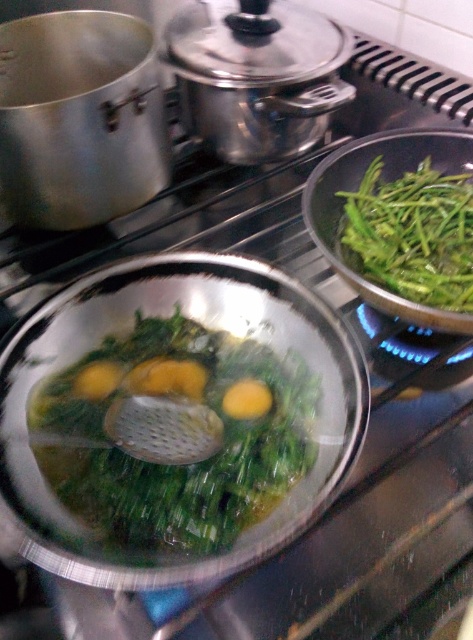
Question: Can you confirm if green leafy vegetables at center is positioned to the left of green leafy vegetable at right?

Choices:
 (A) yes
 (B) no

Answer: (A)

Question: Which of the following is the farthest from the observer?

Choices:
 (A) (239, 452)
 (B) (462, 244)

Answer: (B)

Question: Is green leafy vegetables at center wider than green leafy vegetable at right?

Choices:
 (A) no
 (B) yes

Answer: (B)

Question: Which point appears closest to the camera in this image?

Choices:
 (A) (151, 547)
 (B) (415, 276)

Answer: (A)

Question: Does green leafy vegetables at center appear over green leafy vegetable at right?

Choices:
 (A) no
 (B) yes

Answer: (A)